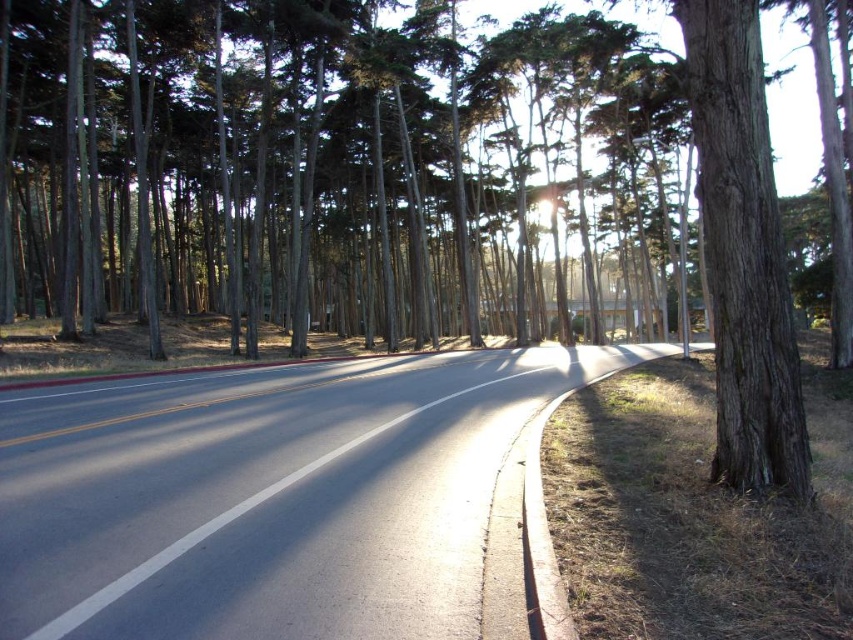
Can you confirm if asphalt road at center is positioned above brown rough bark tree at right?

Actually, asphalt road at center is below brown rough bark tree at right.

Identify the location of asphalt road at center. The height and width of the screenshot is (640, 853). (268, 497).

The height and width of the screenshot is (640, 853). Identify the location of asphalt road at center. (268, 497).